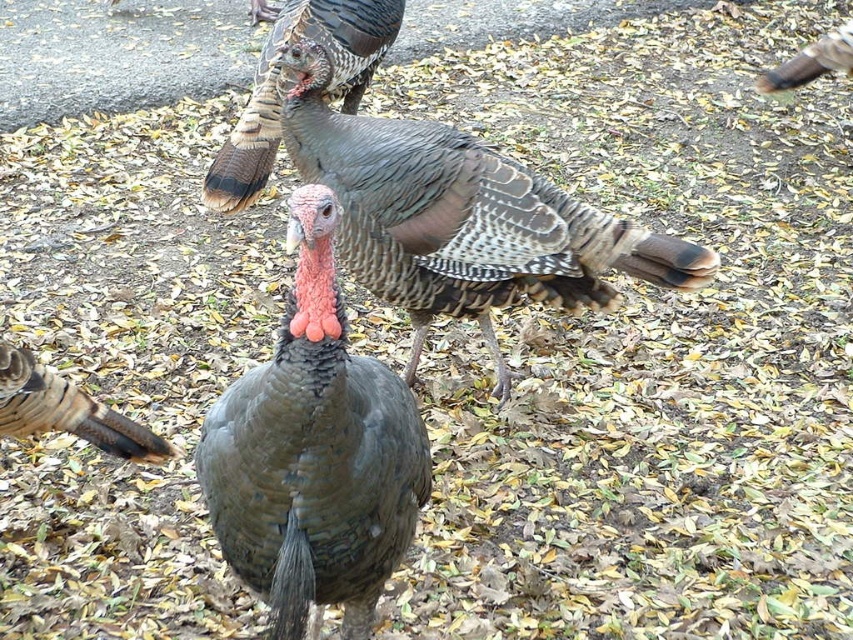
Does gray matte turkey at center appear over speckled feathered turkey at center?

No, gray matte turkey at center is not above speckled feathered turkey at center.

Does gray matte turkey at center come in front of speckled feathered turkey at center?

Yes, gray matte turkey at center is closer to the viewer.

Identify the location of gray matte turkey at center. (314, 454).

Does point (413, 289) come farther from viewer compared to point (815, 74)?

No.

Measure the distance between point (387, 180) and camera.

Point (387, 180) and camera are 7.83 feet apart.

At what (x,y) coordinates should I click in order to perform the action: click on speckled feathered turkey at center. Please return your answer as a coordinate pair (x, y). Looking at the image, I should click on (460, 218).

Can you confirm if speckled feathered turkey at center is wider than speckled feathered turkey at upper center?

Indeed, speckled feathered turkey at center has a greater width compared to speckled feathered turkey at upper center.

Is speckled feathered turkey at center below speckled feathered turkey at upper center?

Indeed, speckled feathered turkey at center is positioned under speckled feathered turkey at upper center.

Identify the location of speckled feathered turkey at center. This screenshot has height=640, width=853. (460, 218).

Find the location of a particular element. The width and height of the screenshot is (853, 640). speckled feathered turkey at center is located at coordinates (460, 218).